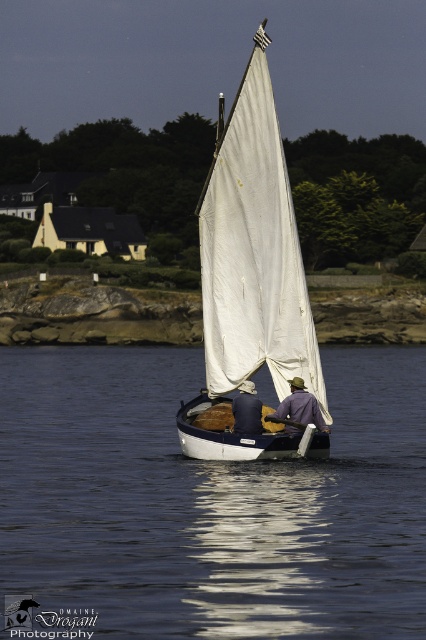
Between point (359, 582) and point (311, 417), which one is positioned in front?

Positioned in front is point (359, 582).

Who is shorter, transparent blue water at center or purple fabric at center?

purple fabric at center is shorter.

Find the location of a particular element. transparent blue water at center is located at coordinates (210, 500).

Can you confirm if white sailboat at center is bigger than purple fabric at center?

Correct, white sailboat at center is larger in size than purple fabric at center.

Is point (215, 452) positioned behind point (293, 378)?

Yes, it is.

This screenshot has height=640, width=426. In order to click on white sailboat at center in this screenshot , I will do `click(227, 433)`.

Which is behind, point (256, 52) or point (259, 417)?

The point (259, 417) is behind.

This screenshot has width=426, height=640. I want to click on white canvas sailboat at center, so click(x=253, y=284).

Where is `white canvas sailboat at center`? This screenshot has width=426, height=640. white canvas sailboat at center is located at coordinates tap(253, 284).